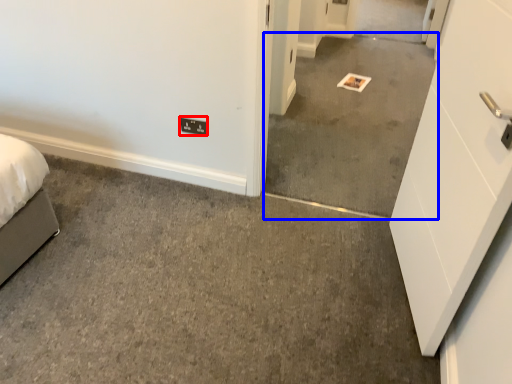
Question: Which object is closer to the camera taking this photo, light switch (highlighted by a red box) or concrete (highlighted by a blue box)?

Choices:
 (A) light switch
 (B) concrete

Answer: (B)